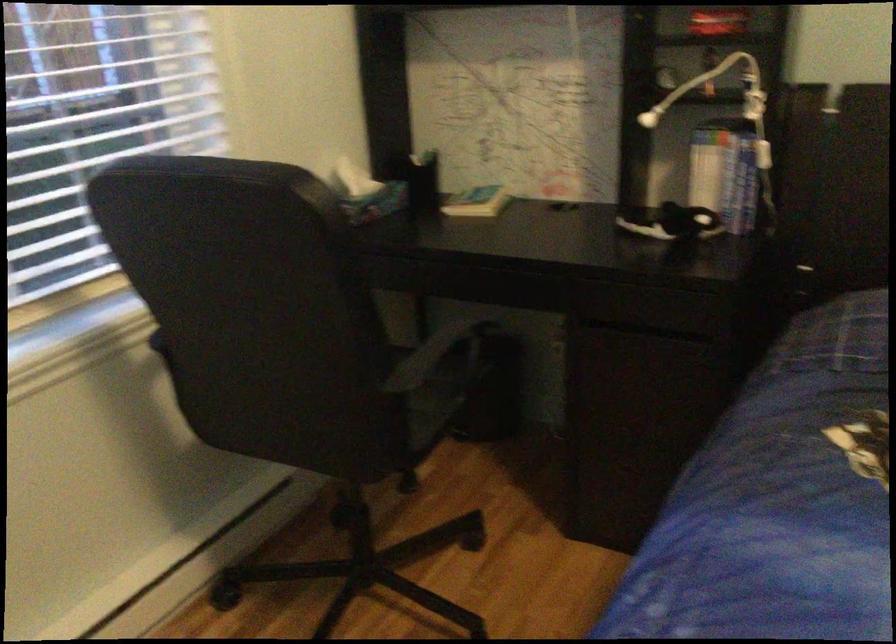
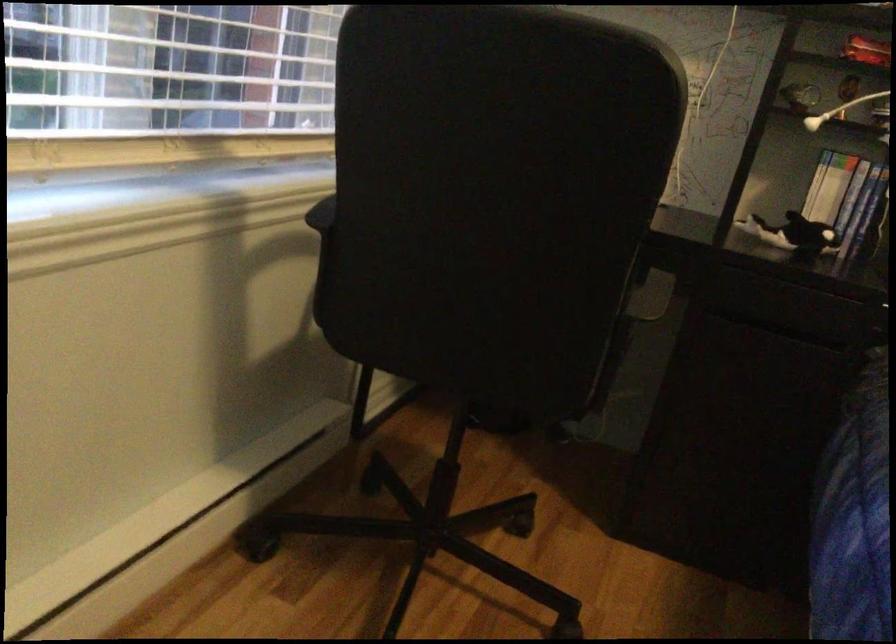
In the second image, find the point that corresponds to the point at 667,222 in the first image.

(793, 234)